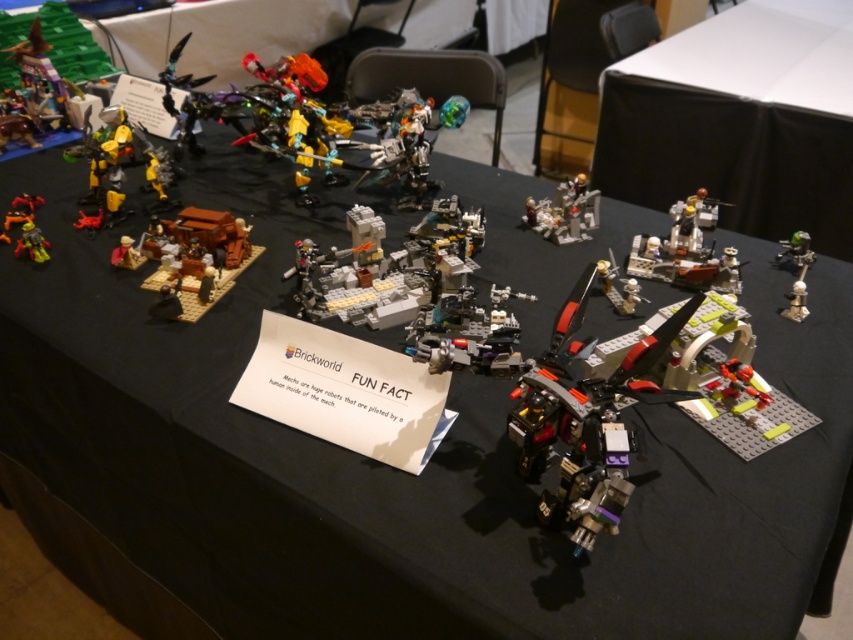
Is metallic silver robot at center positioned in front of green metallic sword at upper right?

No, it is not.

Describe the element at coordinates (564, 212) in the screenshot. I see `metallic silver robot at center` at that location.

Is point (527, 225) farther from viewer compared to point (791, 317)?

Yes, it is.

Find the location of a particular element. This screenshot has width=853, height=640. metallic silver robot at center is located at coordinates (564, 212).

Does metallic silver mech at center-right come in front of metallic silver robot at center?

Yes, metallic silver mech at center-right is closer to the viewer.

Between metallic silver mech at center-right and metallic silver robot at center, which one appears on the right side from the viewer's perspective?

metallic silver mech at center-right

Measure the distance between metallic silver mech at center-right and camera.

metallic silver mech at center-right is 4.07 feet away from camera.

Locate an element on the screen. The height and width of the screenshot is (640, 853). metallic silver mech at center-right is located at coordinates (686, 250).

Which is above, metallic silver mech at center-right or green metallic sword at upper right?

Positioned higher is metallic silver mech at center-right.

Can you confirm if metallic silver mech at center-right is smaller than green metallic sword at upper right?

No.

Does point (727, 268) lie in front of point (788, 314)?

No.

At what (x,y) coordinates should I click in order to perform the action: click on metallic silver mech at center-right. Please return your answer as a coordinate pair (x, y). This screenshot has width=853, height=640. Looking at the image, I should click on (686, 250).